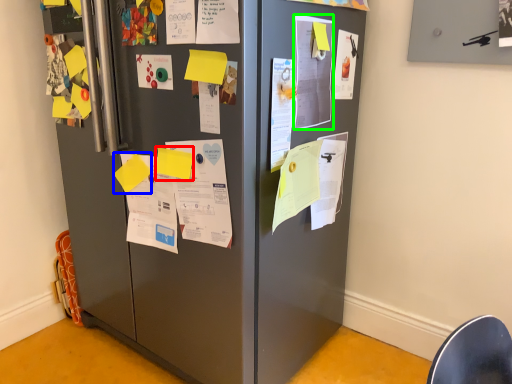
Question: Based on their relative distances, which object is farther from paper (highlighted by a red box)? Choose from paper (highlighted by a blue box) and poster (highlighted by a green box).

Choices:
 (A) paper
 (B) poster

Answer: (B)